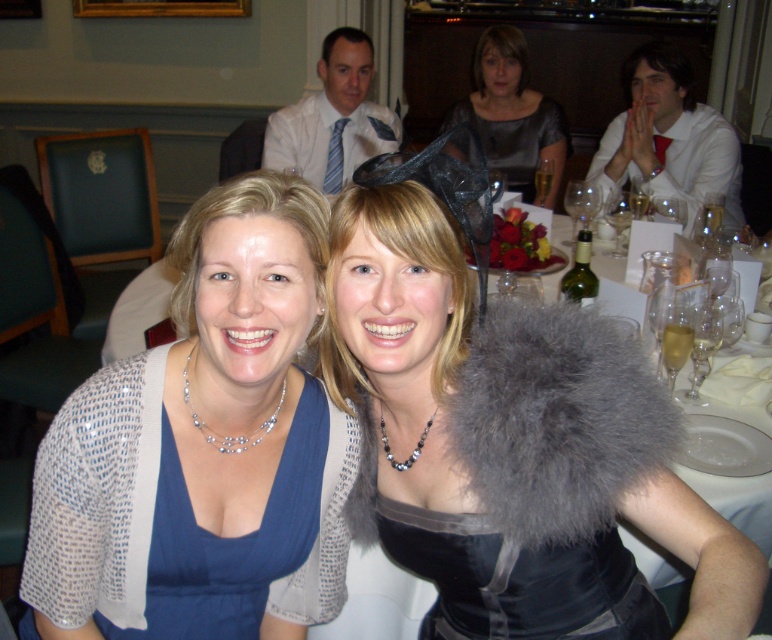
Question: Can you confirm if black satin dress at center is positioned to the right of clear glass wine glass at center?

Choices:
 (A) no
 (B) yes

Answer: (A)

Question: Which object is closer to the camera taking this photo?

Choices:
 (A) black satin dress at center
 (B) matte white shirt at upper center
 (C) shiny silver dress at upper center
 (D) velvet black dress at center

Answer: (A)

Question: Among these points, which one is nearest to the camera?

Choices:
 (A) (689, 106)
 (B) (164, 632)
 (C) (342, 148)
 (D) (635, 369)

Answer: (D)

Question: Among these objects, which one is nearest to the camera?

Choices:
 (A) matte white shirt at upper center
 (B) white satin shirt at upper right
 (C) shiny silver dress at upper center
 (D) velvet black dress at center

Answer: (D)

Question: Can you confirm if matte silver cardigan at center is bigger than white satin shirt at upper right?

Choices:
 (A) no
 (B) yes

Answer: (A)

Question: Is black satin dress at center to the left of matte silver cardigan at center from the viewer's perspective?

Choices:
 (A) no
 (B) yes

Answer: (A)